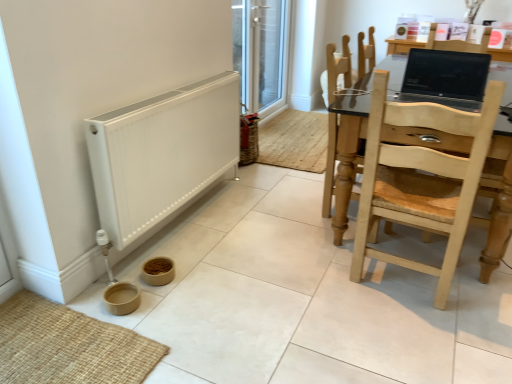
Where is `vacant space in between light brown wooden chair at right, which is the 2th chair from front to back, and white matte heater at lower left`? The height and width of the screenshot is (384, 512). vacant space in between light brown wooden chair at right, which is the 2th chair from front to back, and white matte heater at lower left is located at coordinates (261, 226).